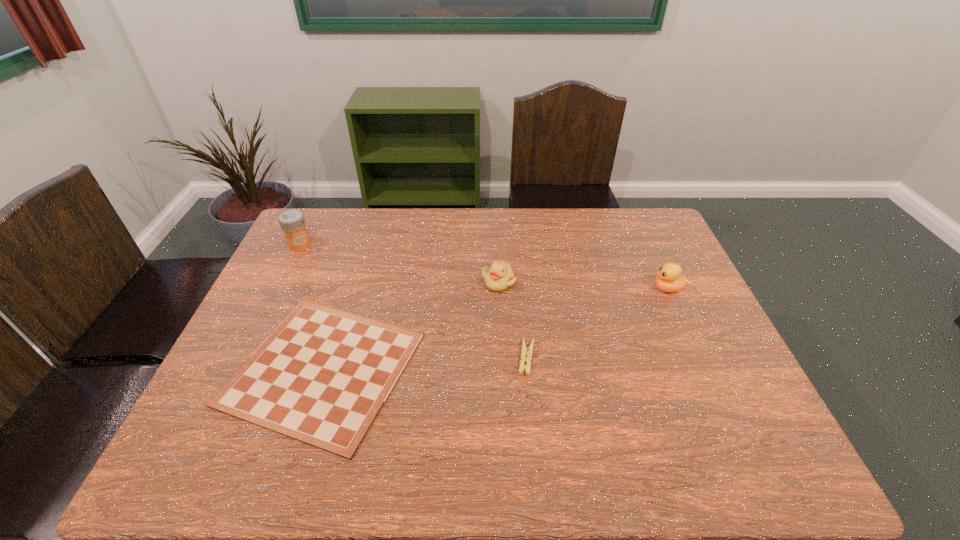
The height and width of the screenshot is (540, 960). Identify the location of the tallest object. (292, 222).

Find the location of a particular element. This screenshot has height=540, width=960. the farthest object is located at coordinates (292, 222).

Locate an element on the screen. The height and width of the screenshot is (540, 960). the rightmost object is located at coordinates (669, 279).

The width and height of the screenshot is (960, 540). Identify the location of the left duckling. (499, 277).

You are a GUI agent. You are given a task and a screenshot of the screen. Output one action in this format:
    pyautogui.click(x=<x>, y=<y>)
    Task: Click on the fourth tallest object
    The image size is (960, 540).
    Given the screenshot: What is the action you would take?
    pyautogui.click(x=525, y=350)

This screenshot has width=960, height=540. I want to click on checkerboard, so click(323, 375).

Find the location of a particular element. Image resolution: width=960 pixels, height=540 pixels. vacant region located 0.330m on the label side of the medicine is located at coordinates (260, 326).

Find the location of a particular element. Image resolution: width=960 pixels, height=540 pixels. vacant space positioned 0.400m on the face of the right duckling is located at coordinates (520, 289).

This screenshot has height=540, width=960. What are the coordinates of `vacant space located 0.160m on the face of the right duckling` in the screenshot? It's located at (599, 289).

The height and width of the screenshot is (540, 960). Find the location of `free space located on the face of the right duckling`. free space located on the face of the right duckling is located at coordinates (550, 289).